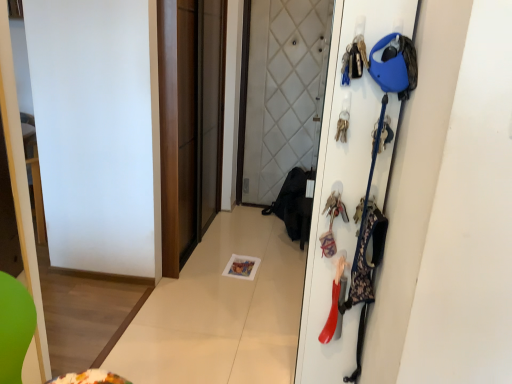
Question: From the image's perspective, would you say floral fabric bag at right, which is the 2th accessory from top to bottom, is shown under white matte door at right?

Choices:
 (A) no
 (B) yes

Answer: (B)

Question: Is floral fabric bag at right, which is the 2th accessory from top to bottom, looking in the opposite direction of white matte door at right?

Choices:
 (A) yes
 (B) no

Answer: (A)

Question: Is floral fabric bag at right, the 2th accessory when ordered from bottom to top, to the left of white matte door at right from the viewer's perspective?

Choices:
 (A) no
 (B) yes

Answer: (A)

Question: Considering the relative sizes of floral fabric bag at right, the 2th accessory when ordered from bottom to top, and white matte door at right in the image provided, is floral fabric bag at right, the 2th accessory when ordered from bottom to top, smaller than white matte door at right?

Choices:
 (A) no
 (B) yes

Answer: (B)

Question: Does floral fabric bag at right, which is the 2th accessory from top to bottom, have a larger size compared to white matte door at right?

Choices:
 (A) no
 (B) yes

Answer: (A)

Question: From a real-world perspective, is brown matte sliding door at center positioned above or below white matte door at right?

Choices:
 (A) below
 (B) above

Answer: (B)

Question: Based on their positions, is brown matte sliding door at center located to the left or right of white matte door at right?

Choices:
 (A) right
 (B) left

Answer: (B)

Question: Relative to white matte door at right, is brown matte sliding door at center in front or behind?

Choices:
 (A) front
 (B) behind

Answer: (B)

Question: Considering the positions of brown matte sliding door at center and white matte door at right in the image, is brown matte sliding door at center bigger or smaller than white matte door at right?

Choices:
 (A) small
 (B) big

Answer: (B)

Question: In terms of width, does white matte door at right look wider or thinner when compared to floral fabric bag at right, which is the 2th accessory from top to bottom?

Choices:
 (A) wide
 (B) thin

Answer: (A)

Question: Visually, is white matte door at right positioned to the left or to the right of floral fabric bag at right, which is the 2th accessory from top to bottom?

Choices:
 (A) right
 (B) left

Answer: (B)

Question: Considering their positions, is white matte door at right located in front of or behind floral fabric bag at right, which is the 2th accessory from top to bottom?

Choices:
 (A) behind
 (B) front

Answer: (B)

Question: From a real-world perspective, is white matte door at right positioned above or below floral fabric bag at right, which is the 2th accessory from top to bottom?

Choices:
 (A) above
 (B) below

Answer: (B)

Question: From their relative heights in the image, would you say brown matte sliding door at center is taller or shorter than metallic keychain at upper right, arranged as the 1th accessory when viewed from the top?

Choices:
 (A) tall
 (B) short

Answer: (A)

Question: Considering the positions of point (203, 61) and point (362, 49), is point (203, 61) closer or farther from the camera than point (362, 49)?

Choices:
 (A) closer
 (B) farther

Answer: (B)